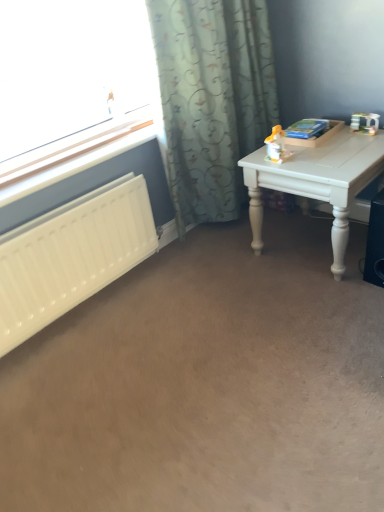
At what (x,y) coordinates should I click in order to perform the action: click on free area in between white painted wood table at right and white matte radiator at left. Please return your answer as a coordinate pair (x, y). Looking at the image, I should click on (188, 291).